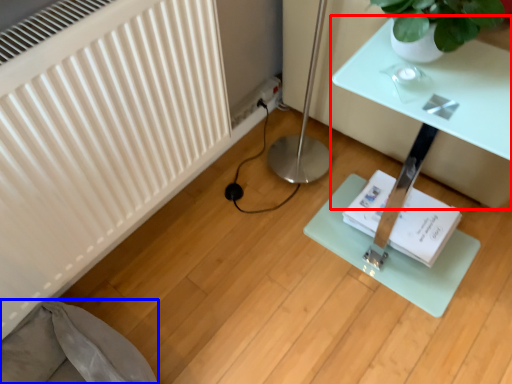
Question: Which of the following is the farthest to the observer, table (highlighted by a red box) or swivel chair (highlighted by a blue box)?

Choices:
 (A) table
 (B) swivel chair

Answer: (A)